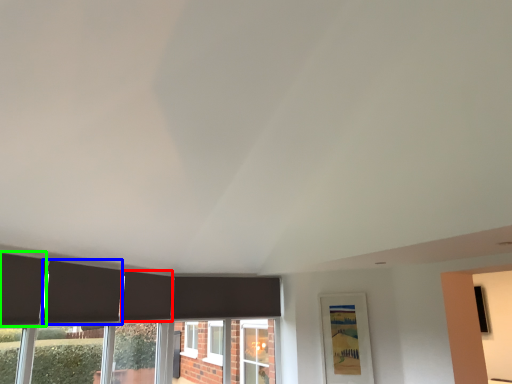
Question: Which object is the closest to the curtain (highlighted by a red box)? Choose among these: curtain (highlighted by a blue box) or curtain (highlighted by a green box).

Choices:
 (A) curtain
 (B) curtain

Answer: (A)